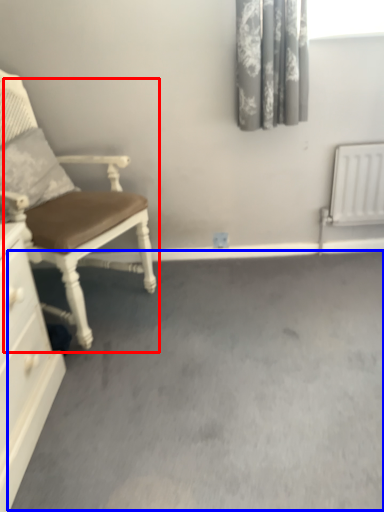
Question: Among these objects, which one is farthest to the camera, chair (highlighted by a red box) or concrete (highlighted by a blue box)?

Choices:
 (A) chair
 (B) concrete

Answer: (A)